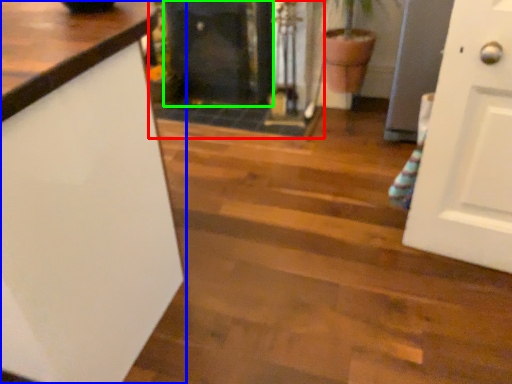
Question: Which is farther away from fireplace (highlighted by a red box)? countertop (highlighted by a blue box) or fireplace (highlighted by a green box)?

Choices:
 (A) countertop
 (B) fireplace

Answer: (A)